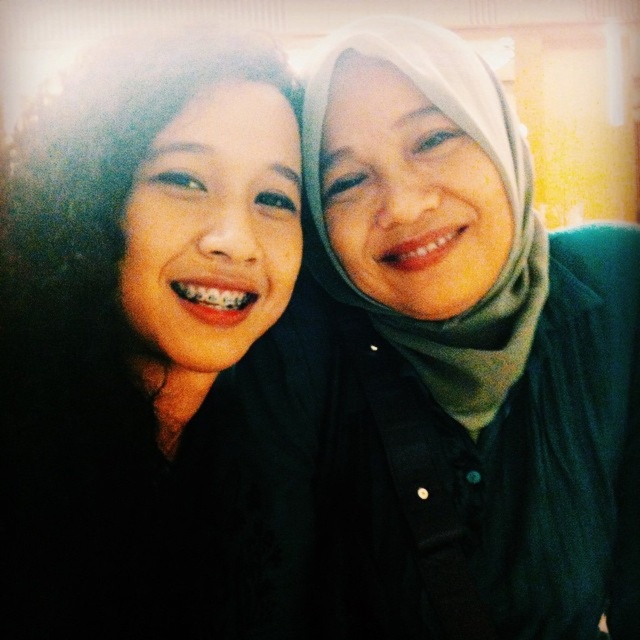
You are a photographer setting up for a group photo. You have two hijabs in the scene, the matte green hijab at upper right and the matte black hijab at upper right. The camera lens has a focal length of 50mm and you want to ensure both hijabs are in focus. Given that the depth of field at this setting allows objects within 30 centimeters of each other to be in focus, will both hijabs appear sharp in the photo?

The matte green hijab at upper right is 29.79 centimeters from the matte black hijab at upper right. Since the depth of field allows objects within 30 centimeters to be in focus, both hijabs will appear sharp in the photo.

In the scene shown: You are a photographer setting up for a group photo. You notice the matte green hijab at upper right and the matte black hijab at upper right in the frame. Which hijab is placed lower in the image?

The matte green hijab at upper right is positioned under the matte black hijab at upper right, so it is lower in the image.

You are taking a photo of two people standing side by side. You notice there are two hijabs in the frame. The matte green hijab at upper right and the matte black hijab at upper right. Which one is wider?

The matte green hijab at upper right is wider than the matte black hijab at upper right according to the description.